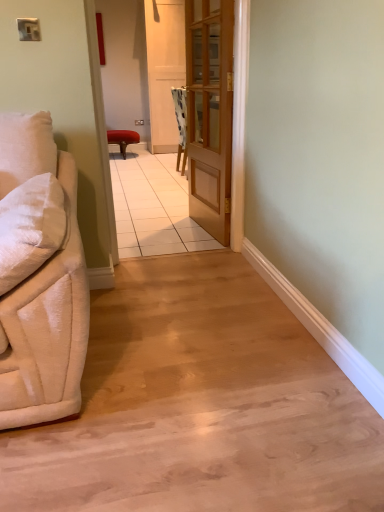
Question: Is wooden screen door at center smaller than wooden door at center?

Choices:
 (A) no
 (B) yes

Answer: (A)

Question: Considering the relative positions of wooden screen door at center and wooden door at center in the image provided, is wooden screen door at center behind wooden door at center?

Choices:
 (A) yes
 (B) no

Answer: (A)

Question: Considering the relative sizes of wooden screen door at center and wooden door at center in the image provided, is wooden screen door at center taller than wooden door at center?

Choices:
 (A) yes
 (B) no

Answer: (A)

Question: Can you see wooden screen door at center touching wooden door at center?

Choices:
 (A) no
 (B) yes

Answer: (A)

Question: Is wooden screen door at center at the left side of wooden door at center?

Choices:
 (A) yes
 (B) no

Answer: (A)

Question: Is wooden screen door at center wider than wooden door at center?

Choices:
 (A) yes
 (B) no

Answer: (A)

Question: Is wooden door at center further to camera compared to velvet beige couch at left?

Choices:
 (A) yes
 (B) no

Answer: (A)

Question: Is wooden door at center positioned beyond the bounds of velvet beige couch at left?

Choices:
 (A) no
 (B) yes

Answer: (B)

Question: From a real-world perspective, does wooden door at center stand above velvet beige couch at left?

Choices:
 (A) no
 (B) yes

Answer: (B)

Question: Can you see wooden door at center touching velvet beige couch at left?

Choices:
 (A) no
 (B) yes

Answer: (A)

Question: Can you confirm if wooden door at center is positioned to the right of velvet beige couch at left?

Choices:
 (A) yes
 (B) no

Answer: (A)

Question: Considering the relative sizes of wooden door at center and velvet beige couch at left in the image provided, is wooden door at center smaller than velvet beige couch at left?

Choices:
 (A) no
 (B) yes

Answer: (A)

Question: Is matte red stool at center to the left of wooden door at center from the viewer's perspective?

Choices:
 (A) yes
 (B) no

Answer: (A)